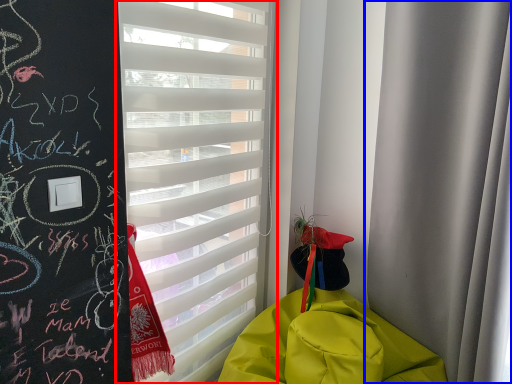
Question: Which object is further to the camera taking this photo, window blind (highlighted by a red box) or curtain (highlighted by a blue box)?

Choices:
 (A) window blind
 (B) curtain

Answer: (A)